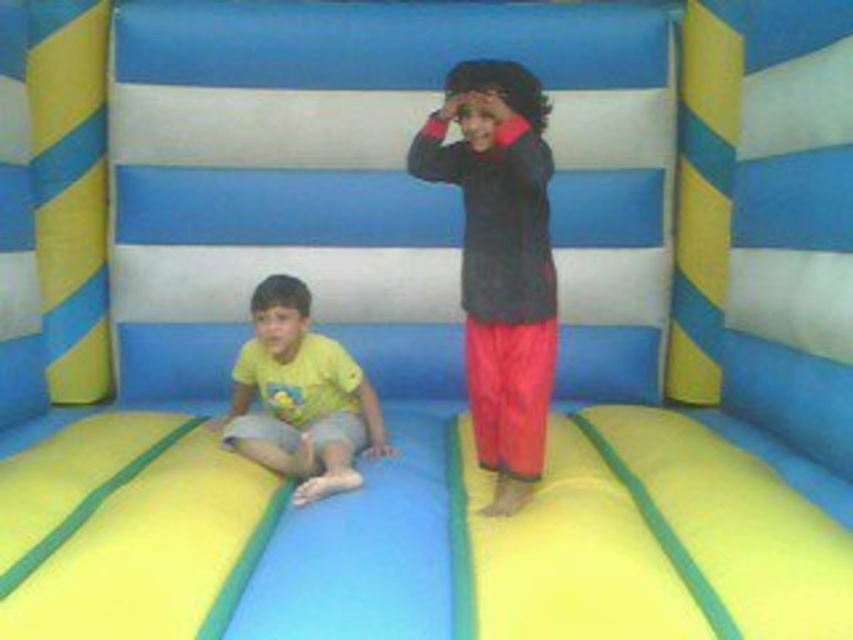
In the scene shown: Measure the distance between point [537,131] and camera.

Point [537,131] is 2.98 meters from camera.

Looking at this image, can you confirm if dark gray fleece jacket at center is wider than yellow matte shirt at lower left?

No.

Image resolution: width=853 pixels, height=640 pixels. Describe the element at coordinates (500, 260) in the screenshot. I see `dark gray fleece jacket at center` at that location.

Identify the location of dark gray fleece jacket at center. The image size is (853, 640). click(x=500, y=260).